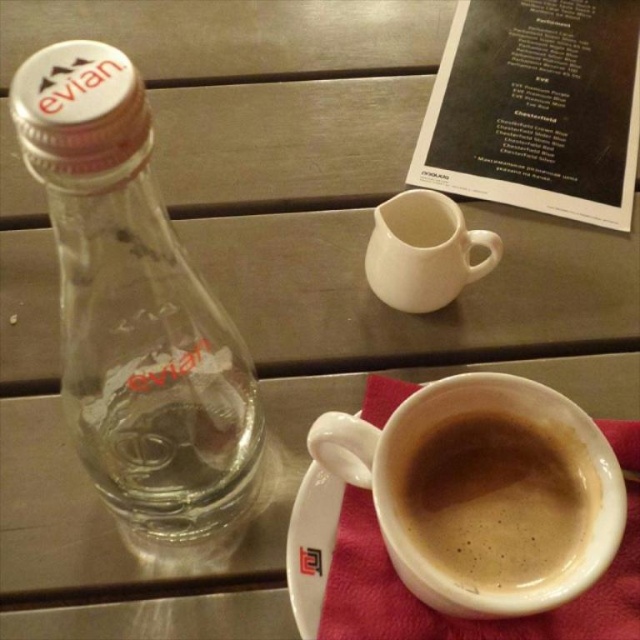
I want to click on brown matte cup at lower center, so click(497, 499).

Who is lower down, clear glass bottle at left or brown matte cup at lower center?

Positioned lower is brown matte cup at lower center.

Can you confirm if clear glass bottle at left is taller than brown matte cup at lower center?

Correct, clear glass bottle at left is much taller as brown matte cup at lower center.

Describe the element at coordinates (132, 305) in the screenshot. I see `clear glass bottle at left` at that location.

The width and height of the screenshot is (640, 640). I want to click on clear glass bottle at left, so click(x=132, y=305).

Does point (531, 499) lie behind point (380, 266)?

No, (531, 499) is closer to viewer.

From the picture: How distant is white ceramic mug at lower center from white ceramic mug at center?

They are 5.96 inches apart.

Which is behind, point (442, 452) or point (428, 289)?

The point (428, 289) is behind.

At what (x,y) coordinates should I click in order to perform the action: click on white ceramic mug at lower center. Please return your answer as a coordinate pair (x, y). The image size is (640, 640). Looking at the image, I should click on (483, 493).